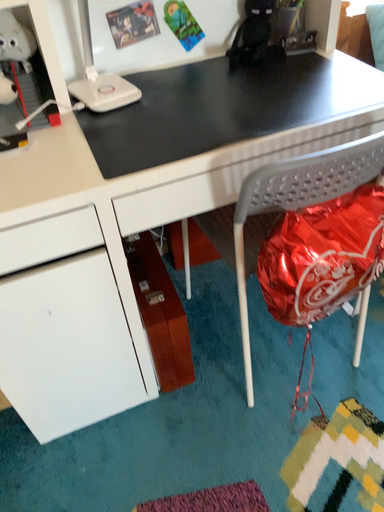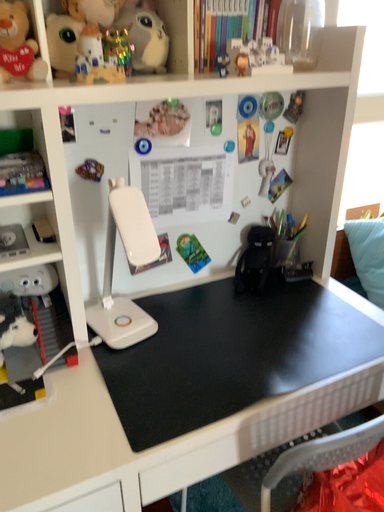
Question: How did the camera likely rotate when shooting the video?

Choices:
 (A) rotated downward
 (B) rotated upward

Answer: (B)